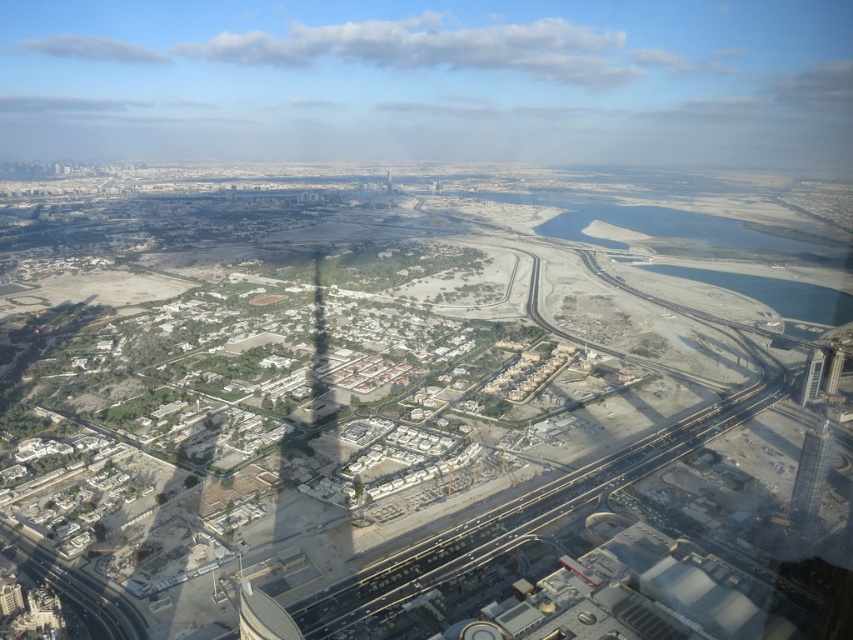
Which is in front, point (811, 380) or point (813, 362)?

Point (813, 362) is more forward.

Can you confirm if metallic glass tower at right is positioned above clear glass window at center?

Yes.

Locate an element on the screen. This screenshot has height=640, width=853. metallic glass tower at right is located at coordinates (x=811, y=376).

Between point (830, 376) and point (389, 193), which one is positioned behind?

Positioned behind is point (389, 193).

Between smooth glass tower at center and smooth glass skyscraper at center, which one has less height?

With less height is smooth glass skyscraper at center.

Between point (837, 372) and point (392, 182), which one is positioned in front?

Point (837, 372) is more forward.

This screenshot has width=853, height=640. Identify the location of smooth glass tower at center. (833, 369).

Who is taller, metallic glass tower at lower right or metallic glass tower at right?

metallic glass tower at lower right

Does point (795, 492) lie behind point (809, 401)?

No, (795, 492) is closer to viewer.

This screenshot has height=640, width=853. I want to click on metallic glass tower at lower right, so click(810, 476).